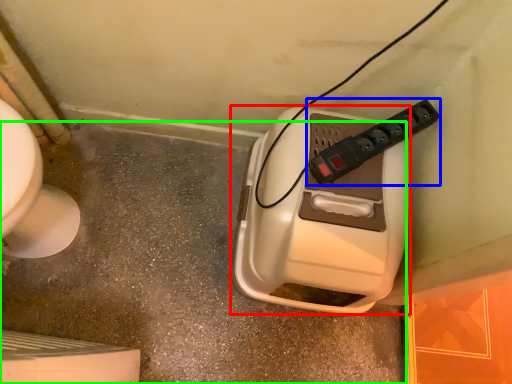
Question: Based on their relative distances, which object is farther from hand dryer (highlighted by a red box)? Choose from power plugs and sockets (highlighted by a blue box) and concrete (highlighted by a green box).

Choices:
 (A) power plugs and sockets
 (B) concrete

Answer: (B)